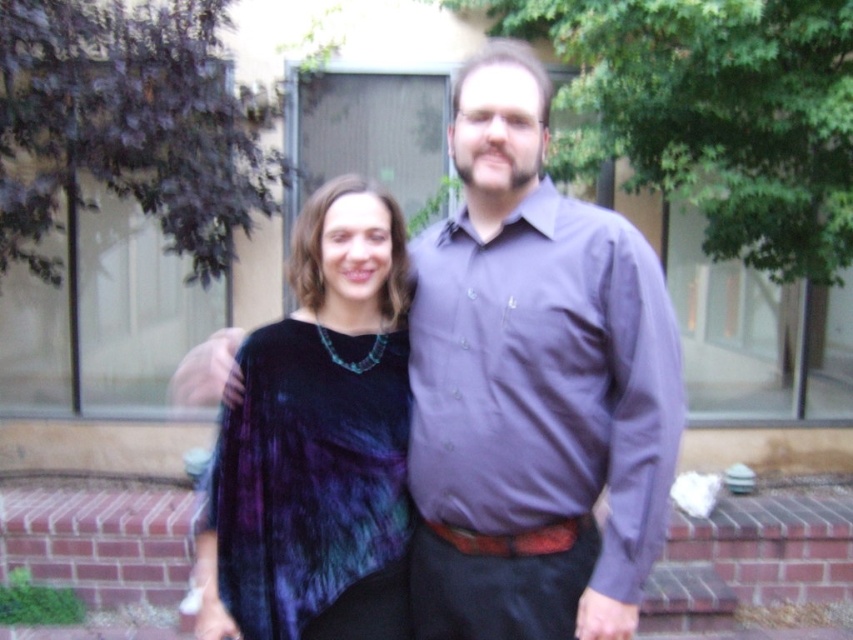
Does velvet black dress at center appear on the left side of velvet tie-dye dress at center?

Incorrect, velvet black dress at center is not on the left side of velvet tie-dye dress at center.

Can you confirm if velvet black dress at center is thinner than velvet tie-dye dress at center?

No.

Is point (433, 304) farther from viewer compared to point (223, 456)?

Yes, it is.

Identify the location of velvet black dress at center. (534, 387).

Is purple cotton shirt at center positioned behind velvet tie-dye dress at center?

No.

Between point (560, 266) and point (328, 552), which one is positioned behind?

The point (328, 552) is behind.

Identify the location of purple cotton shirt at center. This screenshot has width=853, height=640. (544, 380).

Does velvet black dress at center appear under purple cotton shirt at center?

No.

Does point (540, 588) come closer to viewer compared to point (503, 496)?

No, it is not.

The width and height of the screenshot is (853, 640). In order to click on velvet black dress at center in this screenshot , I will do `click(534, 387)`.